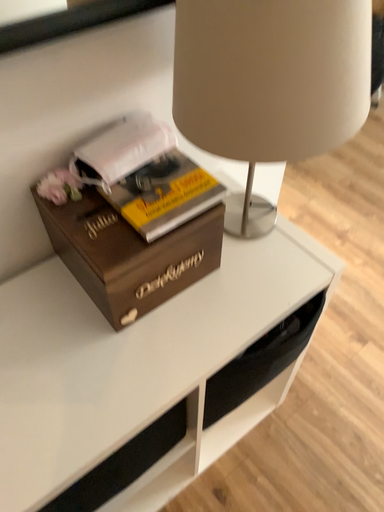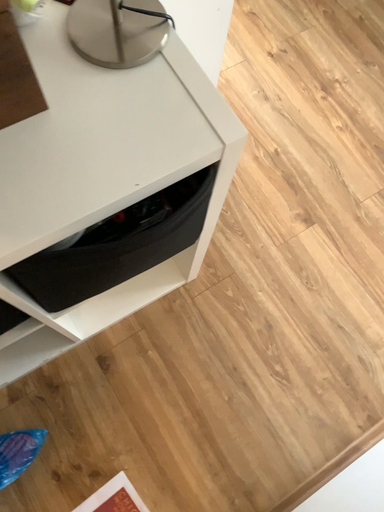
Question: How did the camera likely rotate when shooting the video?

Choices:
 (A) rotated upward
 (B) rotated downward

Answer: (B)